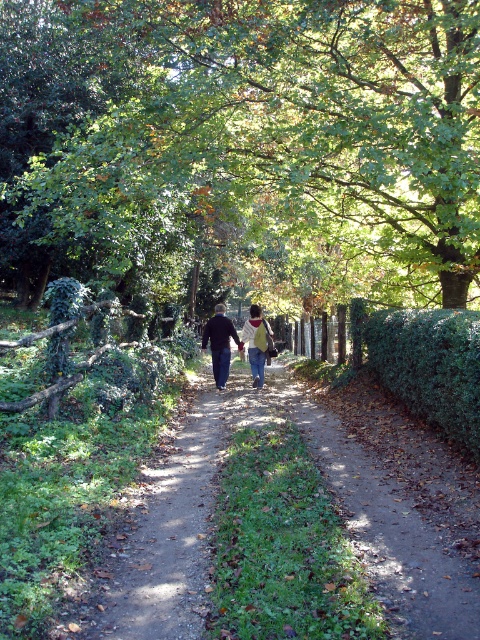
Question: Does green leafy hedge at right appear over denim jacket at center?

Choices:
 (A) no
 (B) yes

Answer: (A)

Question: Which of the following is the closest to the observer?

Choices:
 (A) yellow fabric backpack at center
 (B) green leafy hedge at right

Answer: (B)

Question: Does denim jacket at center have a lesser width compared to yellow fabric backpack at center?

Choices:
 (A) no
 (B) yes

Answer: (A)

Question: Which object is farther from the camera taking this photo?

Choices:
 (A) denim jacket at center
 (B) green leafy tree at center
 (C) green leafy hedge at right

Answer: (A)

Question: Which point is closer to the camera taking this photo?

Choices:
 (A) (252, 321)
 (B) (225, 273)
 (C) (408, 376)

Answer: (C)

Question: Is green leafy hedge at right to the right of denim jacket at center from the viewer's perspective?

Choices:
 (A) yes
 (B) no

Answer: (A)